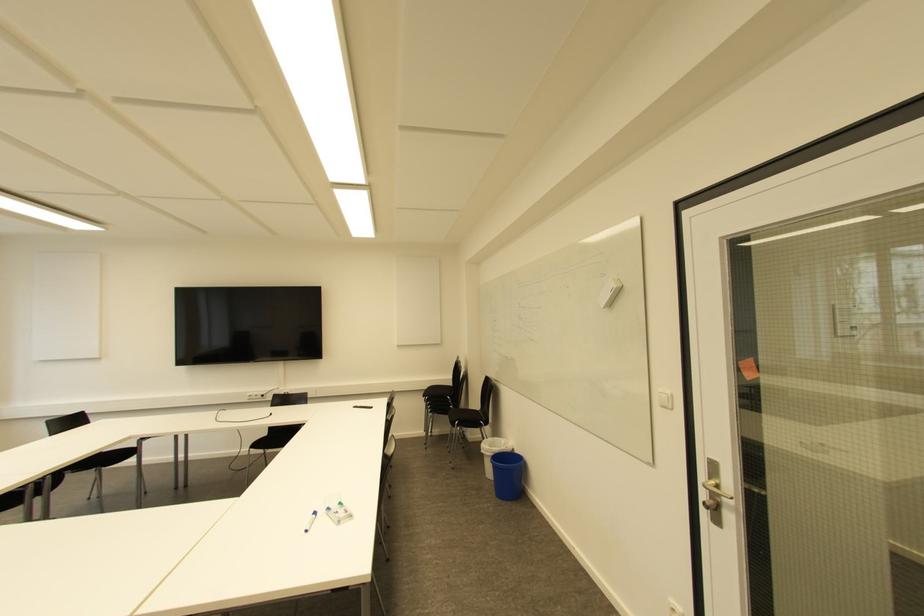
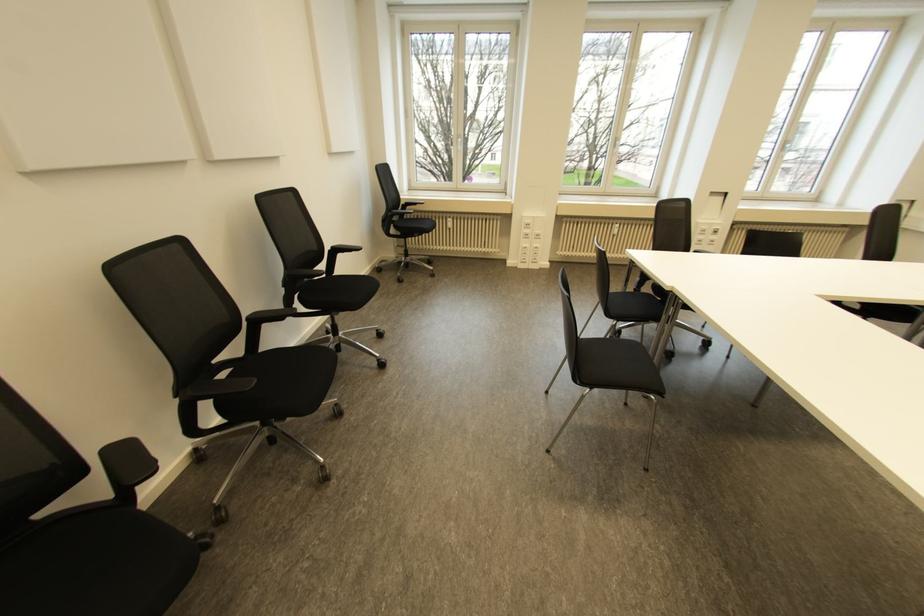
How did the camera likely rotate?

The camera's rotation is toward left-down.